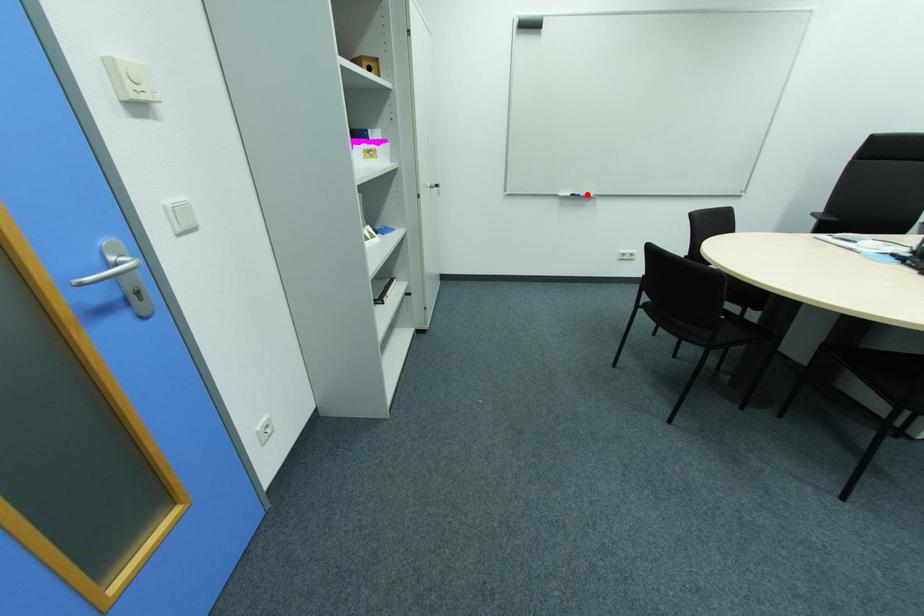
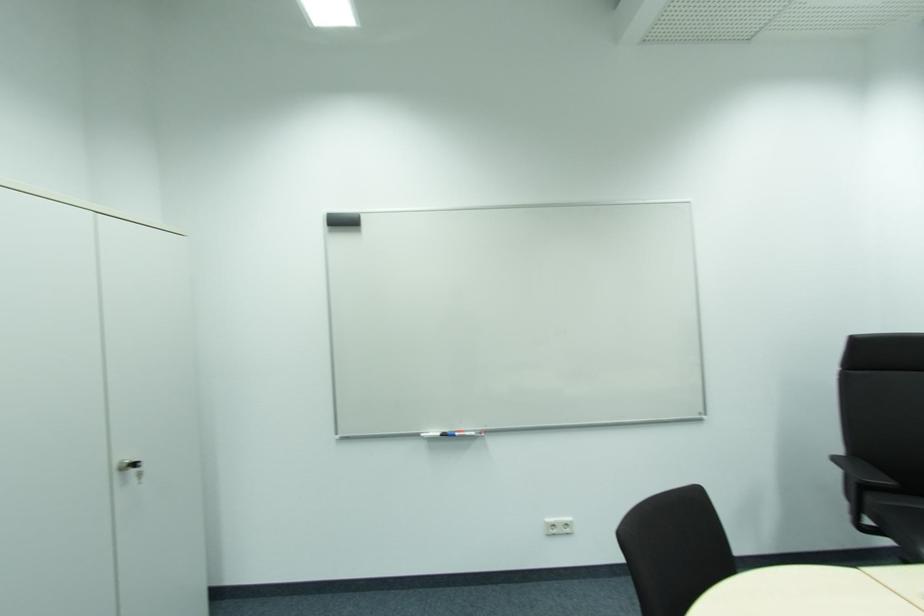
Question: I am providing you with two images of the same scene from different viewpoints. In image1, a red point is highlighted. Considering the same 3D point in image2, which of the following is correct?

Choices:
 (A) It is closer
 (B) It is farther

Answer: (B)